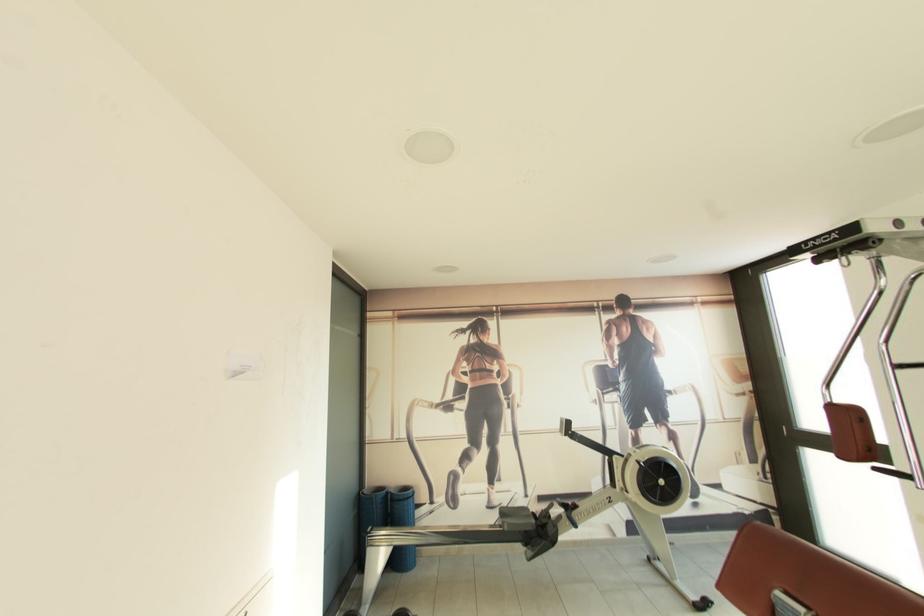
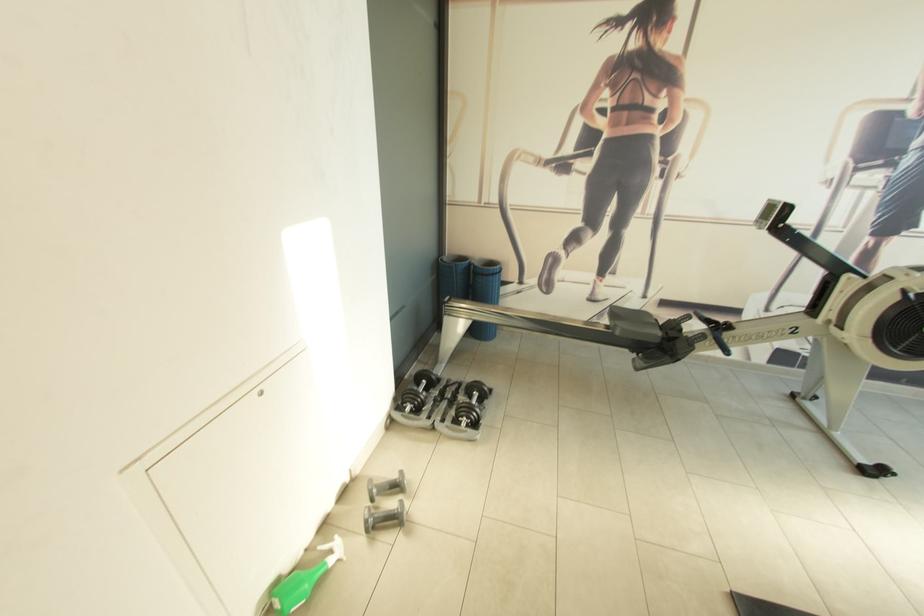
From the picture: Based on the continuous images, in which direction is the camera rotating?

The camera rotated toward left-down.